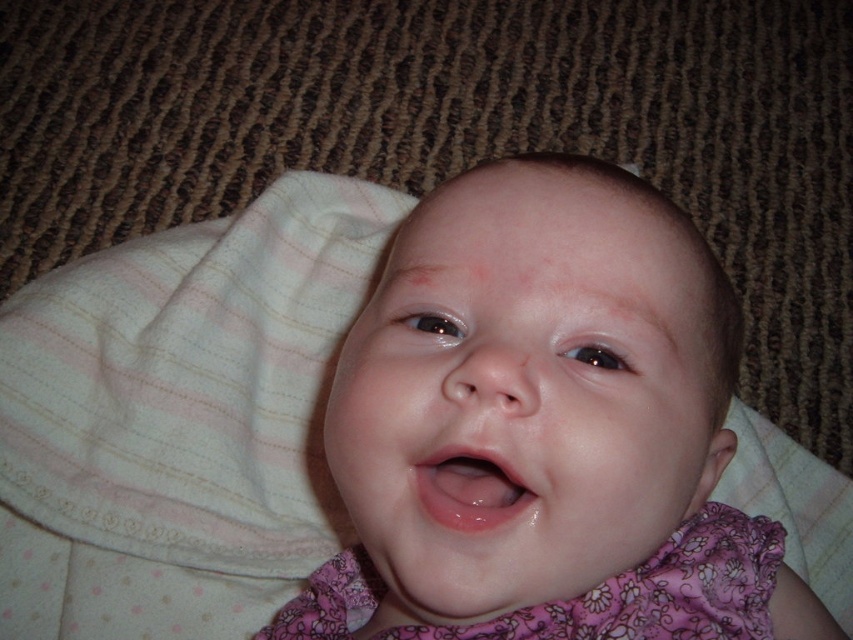
Question: Does white striped fabric at center appear on the right side of smooth skin baby at center?

Choices:
 (A) no
 (B) yes

Answer: (A)

Question: Which point appears closest to the camera in this image?

Choices:
 (A) (473, 497)
 (B) (769, 618)

Answer: (A)

Question: Among these objects, which one is nearest to the camera?

Choices:
 (A) smooth skin baby at center
 (B) glossy pink lips at center
 (C) white striped fabric at center
 (D) pink floral fabric dress at center

Answer: (A)

Question: Which point appears closest to the camera in this image?

Choices:
 (A) [735, 608]
 (B) [509, 580]
 (C) [454, 442]

Answer: (C)

Question: Is smooth skin baby at center to the right of pink floral fabric dress at center from the viewer's perspective?

Choices:
 (A) no
 (B) yes

Answer: (B)

Question: Does white striped fabric at center have a smaller size compared to smooth skin baby at center?

Choices:
 (A) yes
 (B) no

Answer: (B)